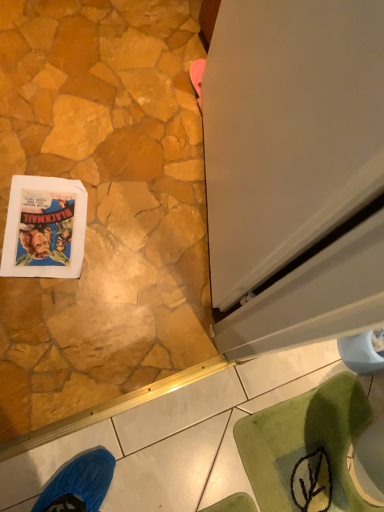
Question: From the image's perspective, does matte paper comic book at lower left appear lower than white glossy screen door at right?

Choices:
 (A) yes
 (B) no

Answer: (A)

Question: Does matte paper comic book at lower left have a greater width compared to white glossy screen door at right?

Choices:
 (A) yes
 (B) no

Answer: (A)

Question: Is matte paper comic book at lower left to the right of white glossy screen door at right from the viewer's perspective?

Choices:
 (A) no
 (B) yes

Answer: (A)

Question: Considering the relative positions of matte paper comic book at lower left and white glossy screen door at right in the image provided, is matte paper comic book at lower left to the left of white glossy screen door at right from the viewer's perspective?

Choices:
 (A) no
 (B) yes

Answer: (B)

Question: Does matte paper comic book at lower left turn towards white glossy screen door at right?

Choices:
 (A) no
 (B) yes

Answer: (A)

Question: Is matte paper comic book at lower left behind white glossy screen door at right?

Choices:
 (A) yes
 (B) no

Answer: (A)

Question: From the image's perspective, is white glossy screen door at right beneath matte paper comic book at lower left?

Choices:
 (A) no
 (B) yes

Answer: (A)

Question: Considering the relative sizes of white glossy screen door at right and matte paper comic book at lower left in the image provided, is white glossy screen door at right taller than matte paper comic book at lower left?

Choices:
 (A) yes
 (B) no

Answer: (A)

Question: From a real-world perspective, is white glossy screen door at right on top of matte paper comic book at lower left?

Choices:
 (A) no
 (B) yes

Answer: (B)

Question: Is white glossy screen door at right at the right side of matte paper comic book at lower left?

Choices:
 (A) yes
 (B) no

Answer: (A)

Question: Can you confirm if white glossy screen door at right is shorter than matte paper comic book at lower left?

Choices:
 (A) yes
 (B) no

Answer: (B)

Question: Does white glossy screen door at right come in front of matte paper comic book at lower left?

Choices:
 (A) no
 (B) yes

Answer: (B)

Question: Choose the correct answer: Is white glossy screen door at right inside matte paper comic book at lower left or outside it?

Choices:
 (A) outside
 (B) inside

Answer: (A)